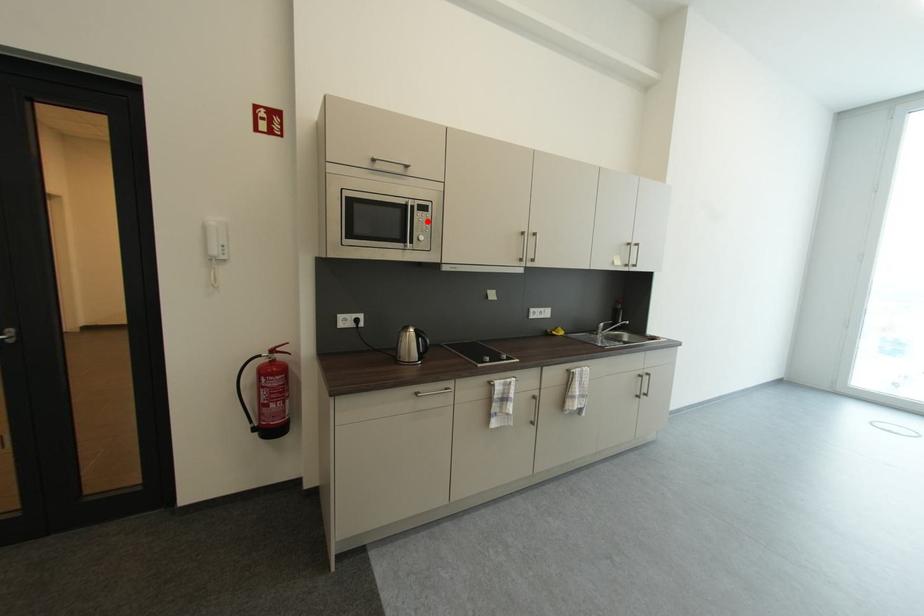
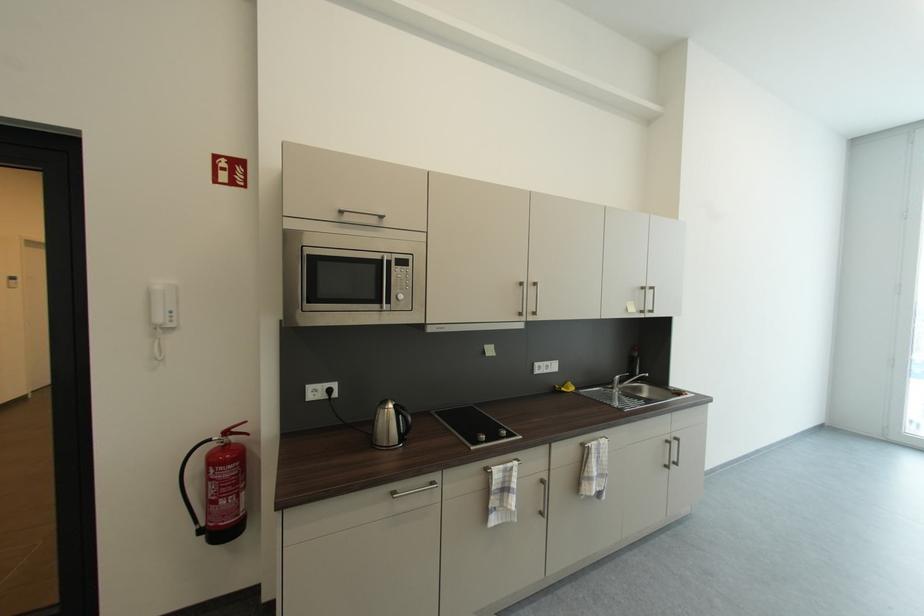
Locate, in the second image, the point that corresponds to the highlighted location in the first image.

(407, 278)